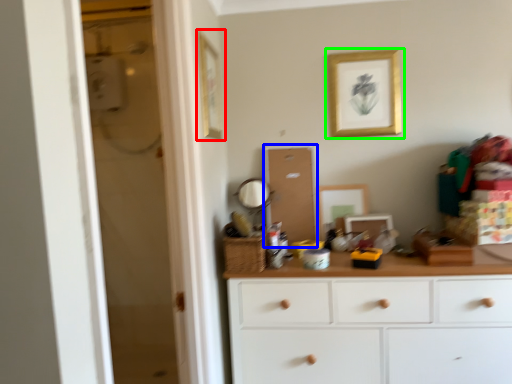
Question: Estimate the real-world distances between objects in this image. Which object is farther from picture frame (highlighted by a red box), screen door (highlighted by a blue box) or picture frame (highlighted by a green box)?

Choices:
 (A) screen door
 (B) picture frame

Answer: (B)